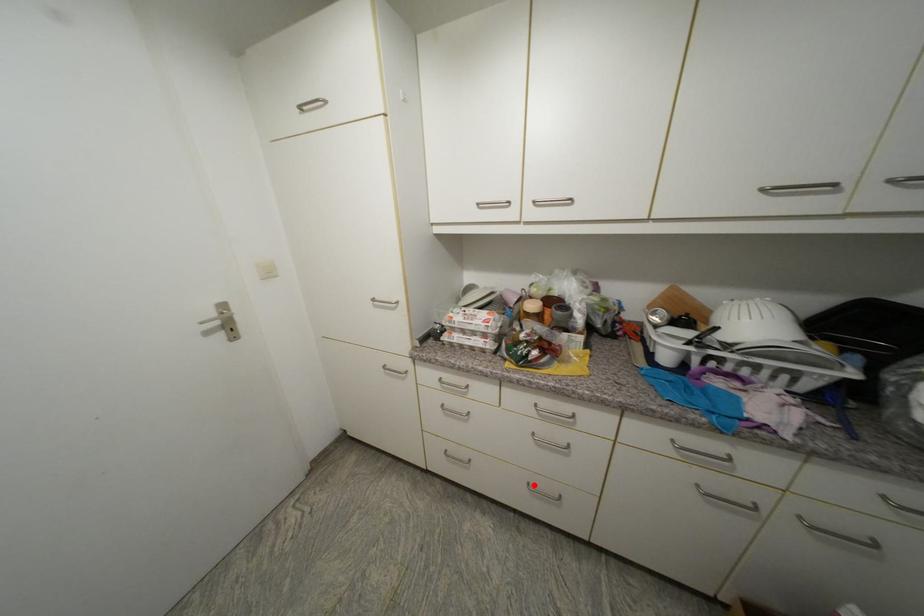
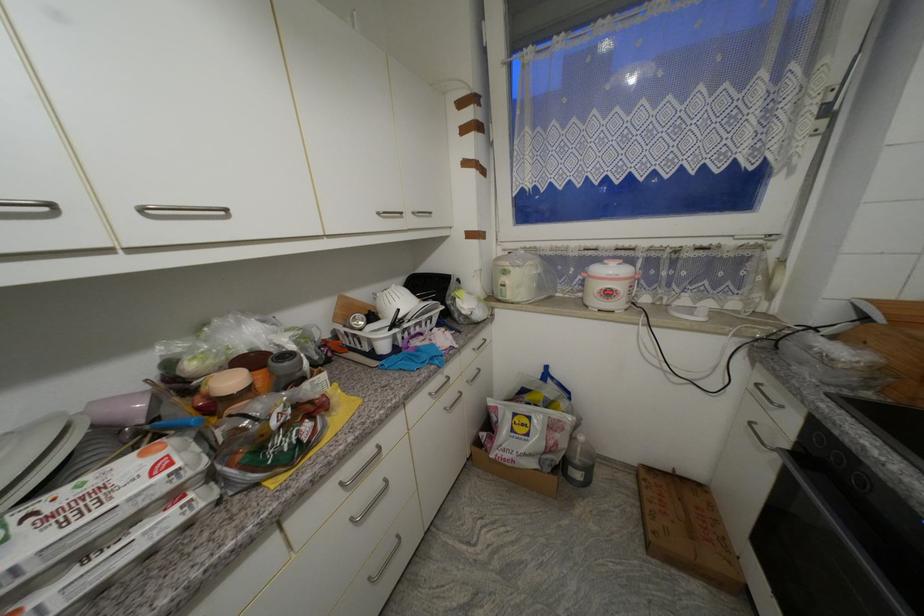
Question: I am providing you with two images of the same scene from different viewpoints. In image1, a red point is highlighted. Considering the same 3D point in image2, which of the following is correct?

Choices:
 (A) It is closer
 (B) It is farther

Answer: (A)